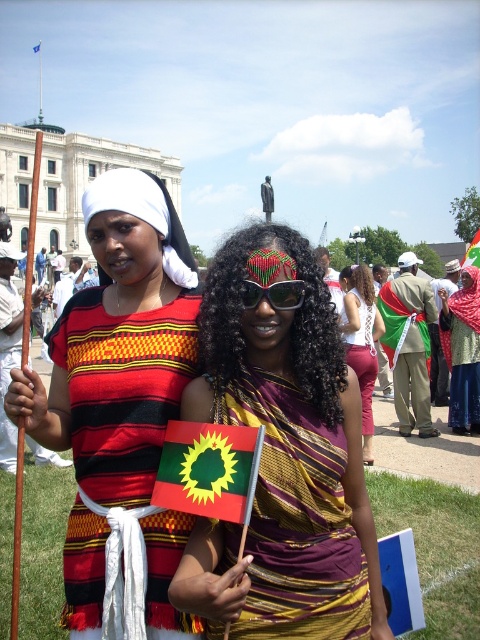
Is point (225, 257) closer to viewer compared to point (90, 376)?

No.

Is matte fabric dress at center thinner than matte black dress at center?

No.

What do you see at coordinates (283, 458) in the screenshot? I see `matte fabric dress at center` at bounding box center [283, 458].

In order to click on matte fabric dress at center in this screenshot , I will do `click(283, 458)`.

Who is taller, matte red pants at center or black plastic sunglasses at center?

Standing taller between the two is matte red pants at center.

Does point (364, 420) lie behind point (292, 294)?

Yes, it is behind point (292, 294).

Find the location of a particular element. This screenshot has height=640, width=480. matte red pants at center is located at coordinates (361, 340).

Between point (236, 317) and point (200, 422), which one is positioned behind?

Positioned behind is point (236, 317).

Between matte fabric dress at center and yellow-green fabric flag at center, which one has less height?

Standing shorter between the two is yellow-green fabric flag at center.

Is point (197, 385) more distant than point (215, 509)?

Yes, point (197, 385) is farther from viewer.

Locate an element on the screen. The height and width of the screenshot is (640, 480). matte fabric dress at center is located at coordinates pyautogui.click(x=283, y=458).